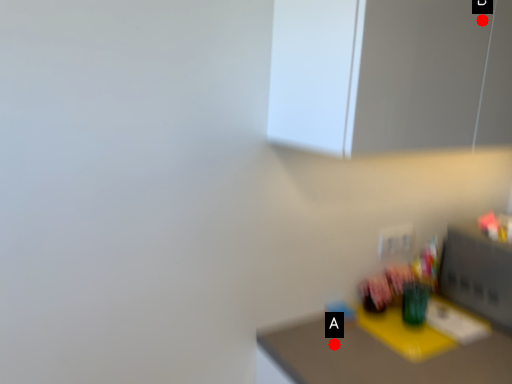
Question: Two points are circled on the image, labeled by A and B beside each circle. Among these points, which one is farthest from the camera?

Choices:
 (A) A is further
 (B) B is further

Answer: (A)